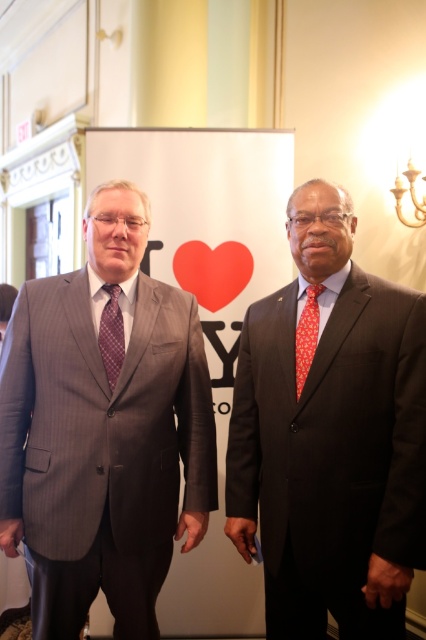
Is plaid silk tie at left thinner than orange printed silk tie at right?

Indeed, plaid silk tie at left has a lesser width compared to orange printed silk tie at right.

Can you confirm if plaid silk tie at left is positioned above orange printed silk tie at right?

Yes, plaid silk tie at left is above orange printed silk tie at right.

Who is more distant from viewer, (104, 332) or (308, 332)?

Point (104, 332)

You are a GUI agent. You are given a task and a screenshot of the screen. Output one action in this format:
    pyautogui.click(x=<x>, y=<y>)
    Task: Click on the plaid silk tie at left
    The width and height of the screenshot is (426, 640).
    Given the screenshot: What is the action you would take?
    pyautogui.click(x=112, y=333)

Is the position of gray pinstripe suit at left more distant than that of dark gray suit at right?

Yes, gray pinstripe suit at left is further from the viewer.

Find the location of a particular element. The width and height of the screenshot is (426, 640). gray pinstripe suit at left is located at coordinates (103, 429).

Describe the element at coordinates (103, 429) in the screenshot. I see `gray pinstripe suit at left` at that location.

Which of these two, gray pinstripe suit at left or orange printed silk tie at right, stands shorter?

Standing shorter between the two is orange printed silk tie at right.

The height and width of the screenshot is (640, 426). I want to click on gray pinstripe suit at left, so click(x=103, y=429).